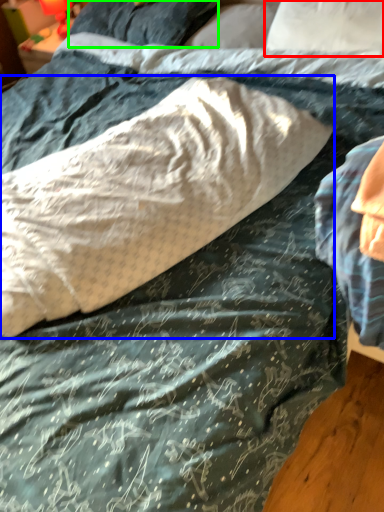
Question: Based on their relative distances, which object is nearer to pillow (highlighted by a red box)? Choose from pillow (highlighted by a blue box) and pillow (highlighted by a green box).

Choices:
 (A) pillow
 (B) pillow

Answer: (B)